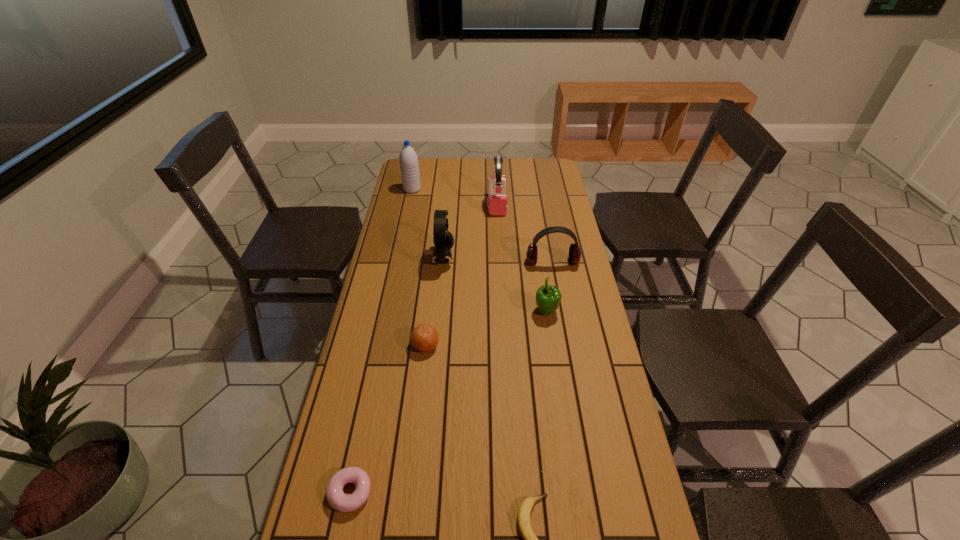
In order to click on vacant space located on the front of the water bottle in this screenshot , I will do `click(408, 208)`.

Locate an element on the screen. The image size is (960, 540). free space located on the outer surface of the second earphone from right to left is located at coordinates (498, 234).

Identify the location of free location located 0.380m on the ear cups of the leftmost earphone. The height and width of the screenshot is (540, 960). (556, 259).

You are a GUI agent. You are given a task and a screenshot of the screen. Output one action in this format:
    pyautogui.click(x=<x>, y=<y>)
    Task: Click on the free location located on the ear cups of the shortest earphone
    This screenshot has width=960, height=540.
    Given the screenshot: What is the action you would take?
    pyautogui.click(x=559, y=298)

Locate an element on the screen. The width and height of the screenshot is (960, 540). vacant space situated on the front of the fourth nearest object is located at coordinates (553, 356).

This screenshot has height=540, width=960. I want to click on free region located on the right of the clementine, so click(x=466, y=346).

The height and width of the screenshot is (540, 960). I want to click on vacant region located 0.180m on the right of the doughnut, so click(x=448, y=492).

Locate an element on the screen. The image size is (960, 540). water bottle that is positioned at the left edge is located at coordinates (408, 160).

At what (x,y) coordinates should I click in order to perform the action: click on doughnut at the left edge. Please return your answer as a coordinate pair (x, y). Looking at the image, I should click on (337, 499).

This screenshot has width=960, height=540. I want to click on earphone at the right edge, so click(574, 251).